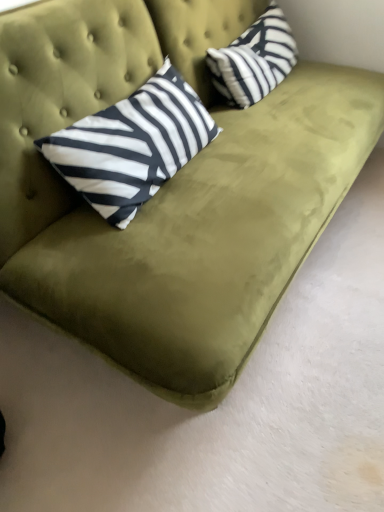
Question: Is black and white striped pillow at upper right, positioned as the 1th pillow in right-to-left order, smaller than white and black striped pillow at upper left, the 1th pillow when ordered from left to right?

Choices:
 (A) no
 (B) yes

Answer: (B)

Question: Are black and white striped pillow at upper right, the 2th pillow positioned from the left, and white and black striped pillow at upper left, the 1th pillow when ordered from left to right, located far from each other?

Choices:
 (A) yes
 (B) no

Answer: (B)

Question: Is black and white striped pillow at upper right, positioned as the 1th pillow in right-to-left order, shorter than white and black striped pillow at upper left, the 1th pillow when ordered from left to right?

Choices:
 (A) yes
 (B) no

Answer: (A)

Question: From a real-world perspective, is black and white striped pillow at upper right, positioned as the 1th pillow in right-to-left order, on top of white and black striped pillow at upper left, the 1th pillow when ordered from left to right?

Choices:
 (A) yes
 (B) no

Answer: (B)

Question: Can you confirm if black and white striped pillow at upper right, the 2th pillow positioned from the left, is bigger than white and black striped pillow at upper left, the 1th pillow when ordered from left to right?

Choices:
 (A) no
 (B) yes

Answer: (A)

Question: Is black and white striped pillow at upper right, positioned as the 1th pillow in right-to-left order, wider than white and black striped pillow at upper left, marked as the second pillow in a right-to-left arrangement?

Choices:
 (A) no
 (B) yes

Answer: (A)

Question: From the image's perspective, would you say white and black striped pillow at upper left, the 1th pillow when ordered from left to right, is positioned over black and white striped pillow at upper right, positioned as the 1th pillow in right-to-left order?

Choices:
 (A) yes
 (B) no

Answer: (B)

Question: Can you confirm if white and black striped pillow at upper left, the 1th pillow when ordered from left to right, is bigger than black and white striped pillow at upper right, positioned as the 1th pillow in right-to-left order?

Choices:
 (A) yes
 (B) no

Answer: (A)

Question: Is white and black striped pillow at upper left, marked as the second pillow in a right-to-left arrangement, oriented towards black and white striped pillow at upper right, positioned as the 1th pillow in right-to-left order?

Choices:
 (A) yes
 (B) no

Answer: (B)

Question: Is white and black striped pillow at upper left, marked as the second pillow in a right-to-left arrangement, thinner than black and white striped pillow at upper right, positioned as the 1th pillow in right-to-left order?

Choices:
 (A) yes
 (B) no

Answer: (B)

Question: Considering the relative positions of white and black striped pillow at upper left, the 1th pillow when ordered from left to right, and black and white striped pillow at upper right, the 2th pillow positioned from the left, in the image provided, is white and black striped pillow at upper left, the 1th pillow when ordered from left to right, in front of black and white striped pillow at upper right, the 2th pillow positioned from the left,?

Choices:
 (A) yes
 (B) no

Answer: (A)

Question: Is black and white striped pillow at upper right, positioned as the 1th pillow in right-to-left order, at the back of white and black striped pillow at upper left, marked as the second pillow in a right-to-left arrangement?

Choices:
 (A) yes
 (B) no

Answer: (B)

Question: Is black and white striped pillow at upper right, the 2th pillow positioned from the left, taller or shorter than white and black striped pillow at upper left, the 1th pillow when ordered from left to right?

Choices:
 (A) short
 (B) tall

Answer: (A)